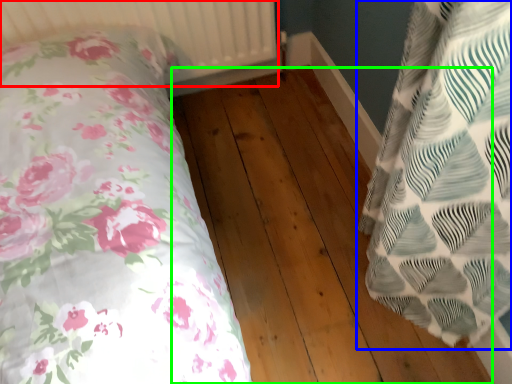
Question: Which object is positioned closest to radiator (highlighted by a red box)? Select from pillow (highlighted by a blue box) and hardwood (highlighted by a green box).

Choices:
 (A) pillow
 (B) hardwood

Answer: (B)